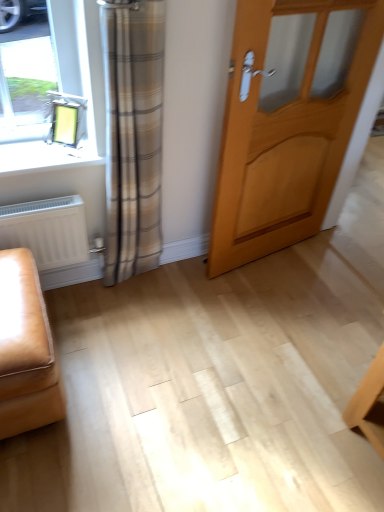
This screenshot has height=512, width=384. What do you see at coordinates (26, 349) in the screenshot?
I see `leather ottoman at lower left` at bounding box center [26, 349].

The height and width of the screenshot is (512, 384). Find the location of `leather ottoman at lower left`. leather ottoman at lower left is located at coordinates (26, 349).

Locate an element on the screen. radiator on the left side of light wood door at center is located at coordinates (47, 230).

Which is behind, light wood door at center or white matte radiator at lower left?

Positioned behind is white matte radiator at lower left.

Can white matte radiator at lower left be found inside light wood door at center?

No, light wood door at center does not contain white matte radiator at lower left.

Which is behind, point (235, 81) or point (45, 209)?

Point (45, 209)

I want to click on radiator behind the leather ottoman at lower left, so click(47, 230).

Who is bigger, leather ottoman at lower left or white matte radiator at lower left?

leather ottoman at lower left.

Is point (27, 311) closer or farther from the camera than point (19, 213)?

Point (27, 311) is positioned closer to the camera compared to point (19, 213).

Can you confirm if leather ottoman at lower left is positioned to the right of white matte radiator at lower left?

Incorrect, leather ottoman at lower left is not on the right side of white matte radiator at lower left.

Considering the positions of objects leather ottoman at lower left and light wood door at center in the image provided, who is more to the right, leather ottoman at lower left or light wood door at center?

From the viewer's perspective, light wood door at center appears more on the right side.

Is leather ottoman at lower left not close to light wood door at center?

Yes, leather ottoman at lower left and light wood door at center are located far from each other.

Does point (6, 288) lie behind point (238, 173)?

No, (6, 288) is closer to viewer.

Which is correct: leather ottoman at lower left is inside light wood door at center, or outside of it?

leather ottoman at lower left is spatially situated outside light wood door at center.

Can you confirm if light wood door at center is positioned to the left of leather ottoman at lower left?

Incorrect, light wood door at center is not on the left side of leather ottoman at lower left.

Considering the sizes of light wood door at center and leather ottoman at lower left in the image, is light wood door at center bigger or smaller than leather ottoman at lower left?

In the image, light wood door at center appears to be larger than leather ottoman at lower left.

Consider the image. Is leather ottoman at lower left at the back of light wood door at center?

No.

Is light wood door at center directly adjacent to leather ottoman at lower left?

No, light wood door at center is not making contact with leather ottoman at lower left.

Measure the distance from white matte radiator at lower left to light wood door at center.

white matte radiator at lower left is 33.24 inches away from light wood door at center.

Considering the relative sizes of white matte radiator at lower left and light wood door at center in the image provided, is white matte radiator at lower left smaller than light wood door at center?

Yes.

Is white matte radiator at lower left thinner than light wood door at center?

In fact, white matte radiator at lower left might be wider than light wood door at center.

The height and width of the screenshot is (512, 384). I want to click on radiator behind the light wood door at center, so click(47, 230).

Based on the photo, how different are the orientations of white matte radiator at lower left and leather ottoman at lower left in degrees?

There is a 0.872-degree angle between the facing directions of white matte radiator at lower left and leather ottoman at lower left.

Considering the relative sizes of white matte radiator at lower left and leather ottoman at lower left in the image provided, is white matte radiator at lower left smaller than leather ottoman at lower left?

Correct, white matte radiator at lower left occupies less space than leather ottoman at lower left.

Based on the photo, considering the relative positions of white matte radiator at lower left and leather ottoman at lower left in the image provided, is white matte radiator at lower left to the right of leather ottoman at lower left from the viewer's perspective?

Yes.

Is white matte radiator at lower left positioned beyond the bounds of leather ottoman at lower left?

Yes, white matte radiator at lower left is not within leather ottoman at lower left.

Where is `radiator behind the light wood door at center`? radiator behind the light wood door at center is located at coordinates (47, 230).

Image resolution: width=384 pixels, height=512 pixels. What are the coordinates of `furniture below the white matte radiator at lower left (from the image's perspective)` in the screenshot? It's located at pos(26,349).

Looking at the image, which one is located further to leather ottoman at lower left, light wood door at center or white matte radiator at lower left?

light wood door at center is positioned further to the anchor leather ottoman at lower left.

Considering their positions, is leather ottoman at lower left positioned further to white matte radiator at lower left than light wood door at center?

light wood door at center is positioned further to the anchor white matte radiator at lower left.

When comparing their distances from light wood door at center, does white matte radiator at lower left or leather ottoman at lower left seem further?

Among the two, leather ottoman at lower left is located further to light wood door at center.

From the picture: Based on their spatial positions, is white matte radiator at lower left or light wood door at center further from leather ottoman at lower left?

Based on the image, light wood door at center appears to be further to leather ottoman at lower left.

Estimate the real-world distances between objects in this image. Which object is further from white matte radiator at lower left, light wood door at center or leather ottoman at lower left?

The object further to white matte radiator at lower left is light wood door at center.

Which object lies nearer to the anchor point light wood door at center, leather ottoman at lower left or white matte radiator at lower left?

white matte radiator at lower left is closer to light wood door at center.

This screenshot has width=384, height=512. I want to click on radiator between leather ottoman at lower left and light wood door at center in the horizontal direction, so click(x=47, y=230).